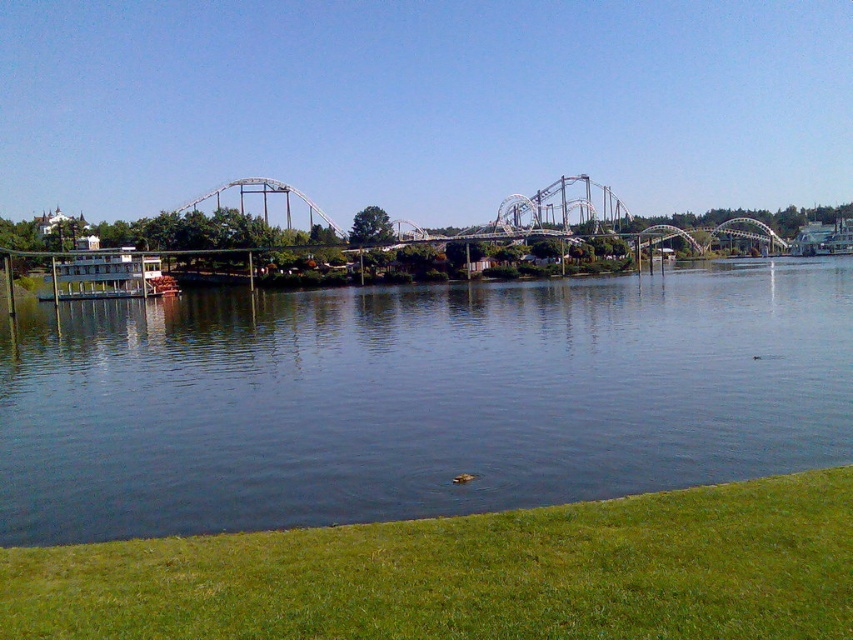
You are standing on the green grass at lower right and want to look up at the white matte roller coaster at upper center. Which direction should you turn your head to see it?

Since the green grass at lower right is below the white matte roller coaster at upper center, you should look upward to see it.